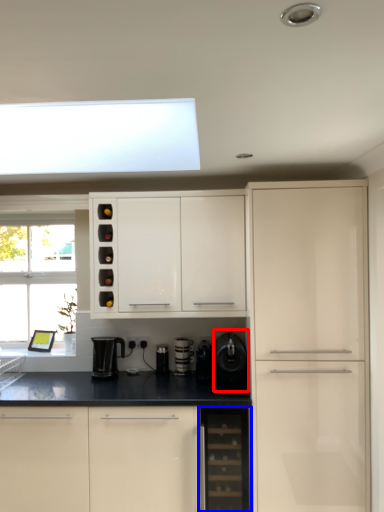
Question: Among these objects, which one is nearest to the camera, appliance (highlighted by a red box) or dish washer (highlighted by a blue box)?

Choices:
 (A) appliance
 (B) dish washer

Answer: (B)